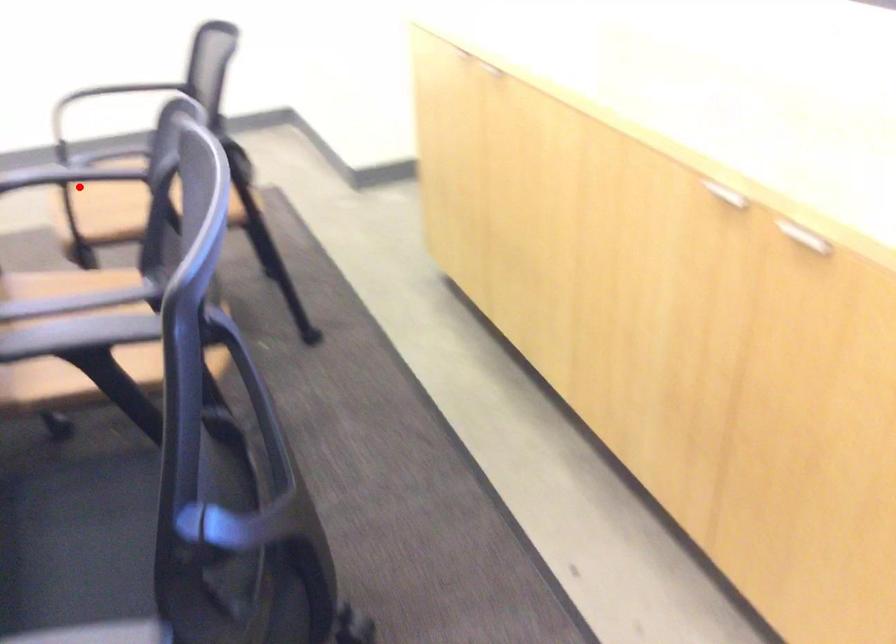
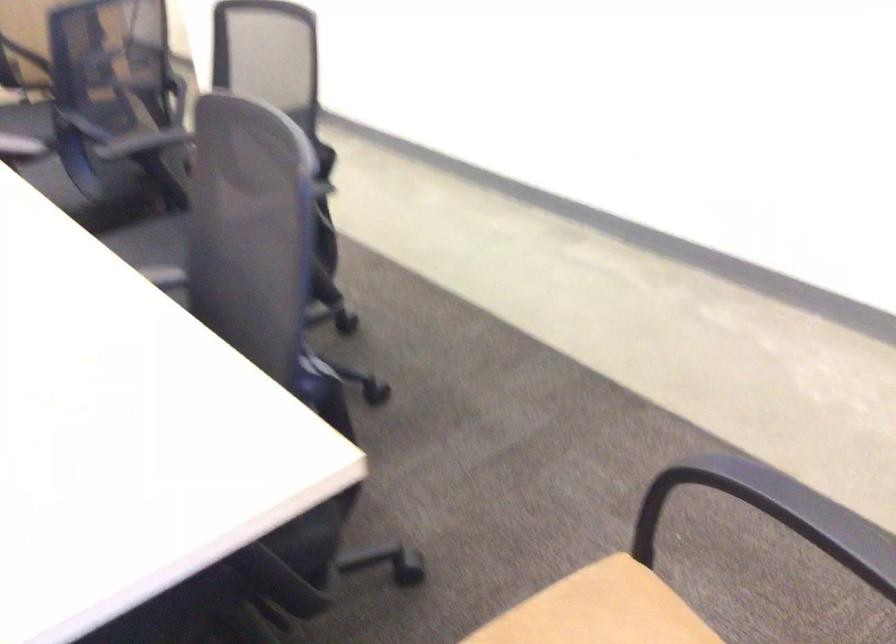
Locate, in the second image, the point that corresponds to the highlighted location in the first image.

(584, 609)